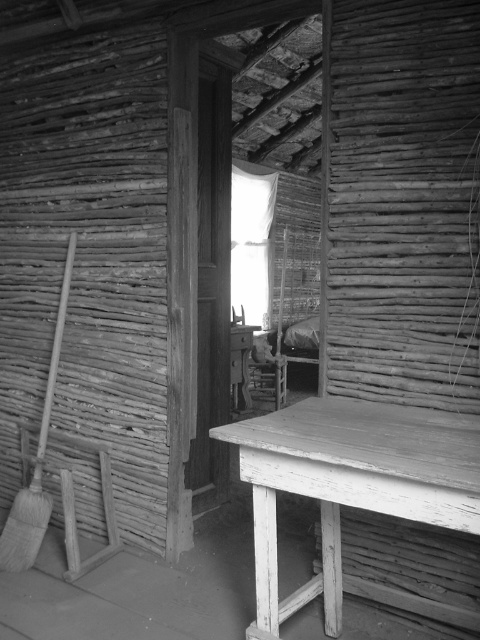
Who is shorter, smooth white wooden table at center or wooden broom at left?

With less height is smooth white wooden table at center.

Is point (363, 449) positioned behind point (15, 512)?

No, (363, 449) is in front of (15, 512).

At what (x,y) coordinates should I click in order to perform the action: click on smooth white wooden table at center. Please return your answer as a coordinate pair (x, y). Looking at the image, I should click on (350, 483).

You are a GUI agent. You are given a task and a screenshot of the screen. Output one action in this format:
    pyautogui.click(x=<x>, y=<y>)
    Task: Click on the smooth white wooden table at center
    This screenshot has width=480, height=640.
    Given the screenshot: What is the action you would take?
    pyautogui.click(x=350, y=483)

Between smooth white wooden table at center and transparent glass window at center, which one is positioned higher?

transparent glass window at center

I want to click on smooth white wooden table at center, so click(350, 483).

Locate an element on the screen. The height and width of the screenshot is (640, 480). smooth white wooden table at center is located at coordinates (350, 483).

Is transparent glass window at center thinner than wooden broom at left?

No, transparent glass window at center is not thinner than wooden broom at left.

Does transparent glass window at center have a greater height compared to wooden broom at left?

Yes, transparent glass window at center is taller than wooden broom at left.

Describe the element at coordinates (251, 243) in the screenshot. I see `transparent glass window at center` at that location.

Where is `transparent glass window at center`? This screenshot has width=480, height=640. transparent glass window at center is located at coordinates (251, 243).